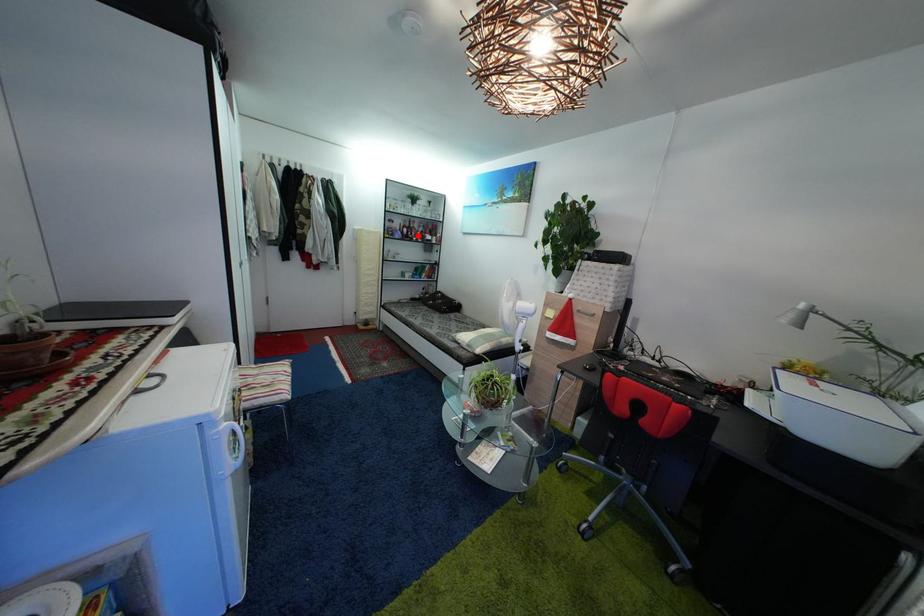
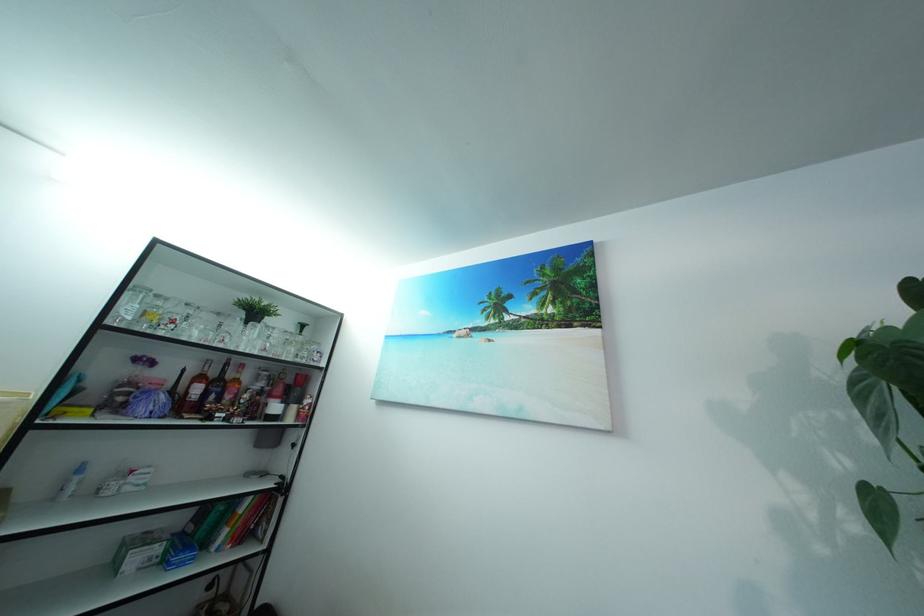
Where in the second image is the point corresponding to the highlighted location from the first image?

(226, 391)